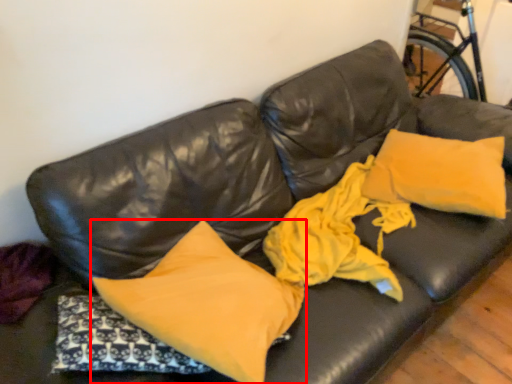
Question: Considering the relative positions of pillow (annotated by the red box) and pillow in the image provided, where is pillow (annotated by the red box) located with respect to the staircase?

Choices:
 (A) right
 (B) left

Answer: (B)